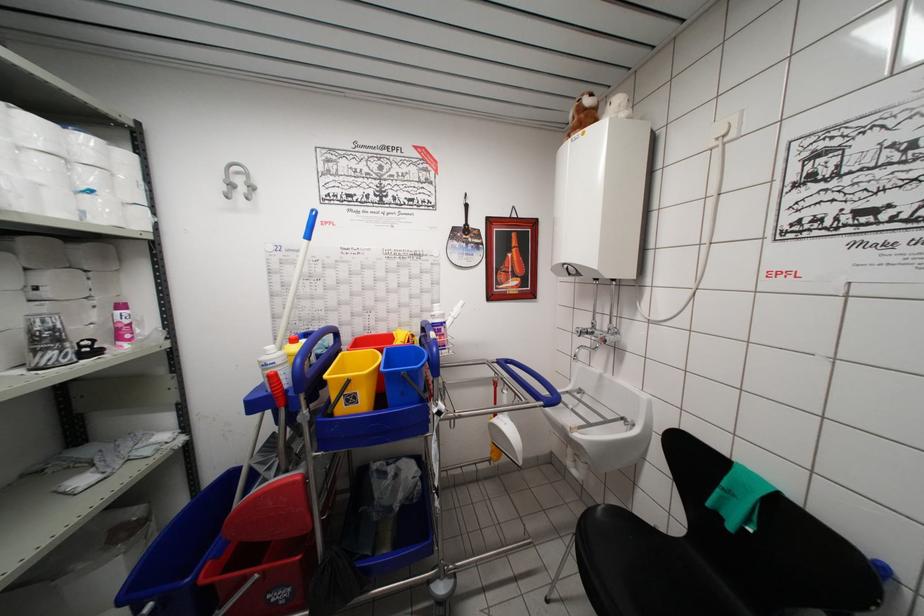
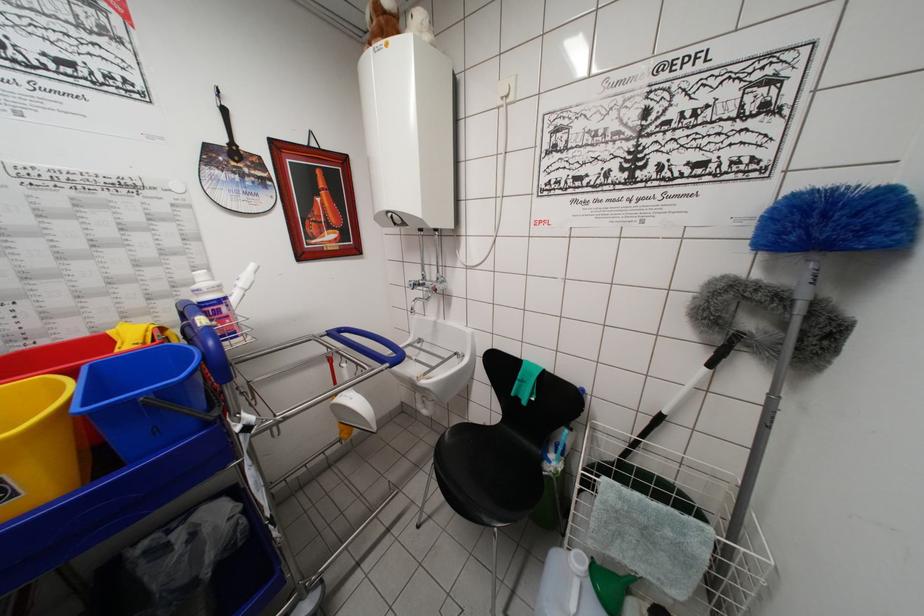
Locate, in the second image, the point that corresponds to the point at 434,342 in the first image.

(202, 330)